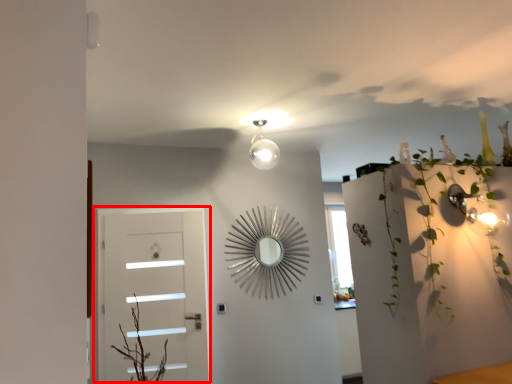
Question: In this image, where is door (annotated by the red box) located relative to plant?

Choices:
 (A) right
 (B) left

Answer: (B)